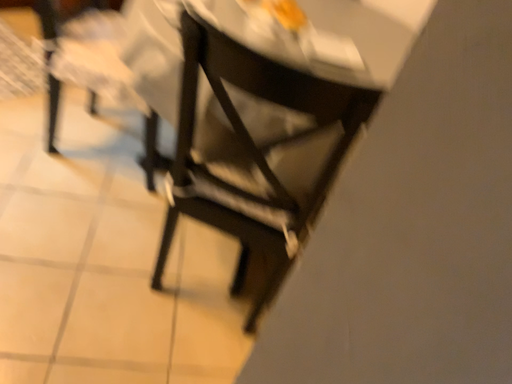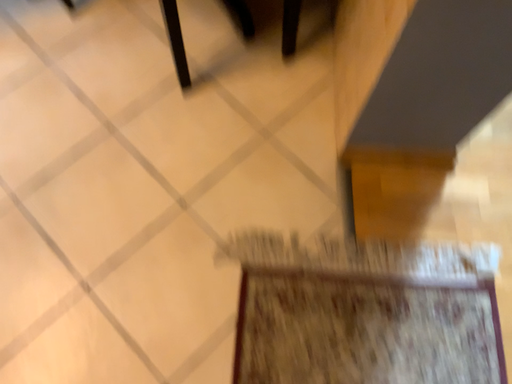
Question: How did the camera likely rotate when shooting the video?

Choices:
 (A) rotated downward
 (B) rotated upward

Answer: (A)